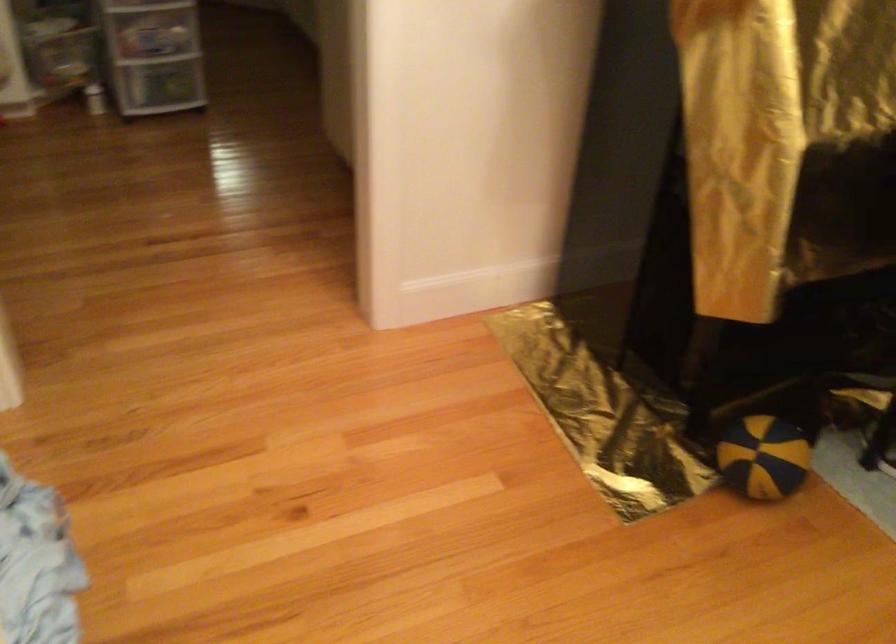
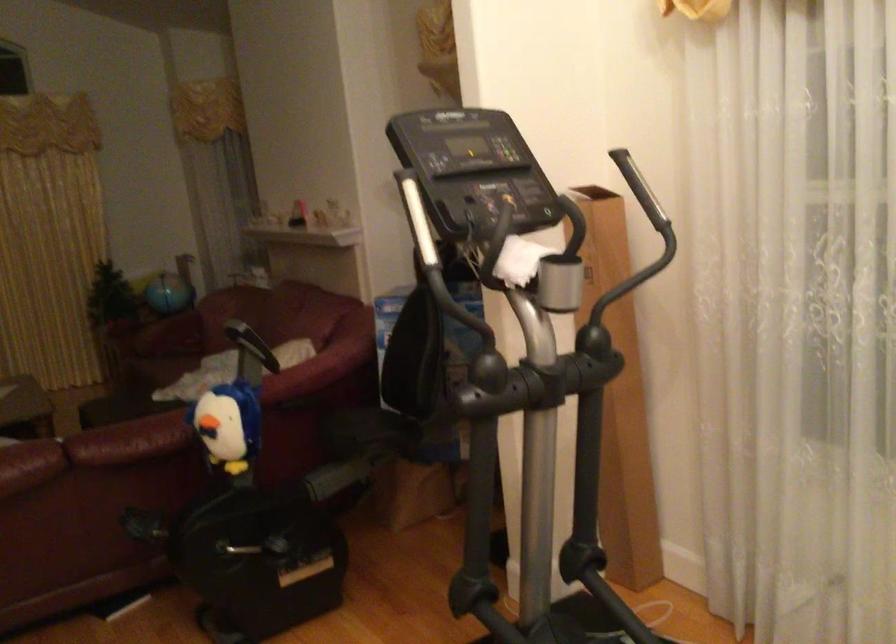
Question: The first image is from the beginning of the video and the second image is from the end. How did the camera likely rotate when shooting the video?

Choices:
 (A) Left
 (B) Right
 (C) Up
 (D) Down

Answer: (B)